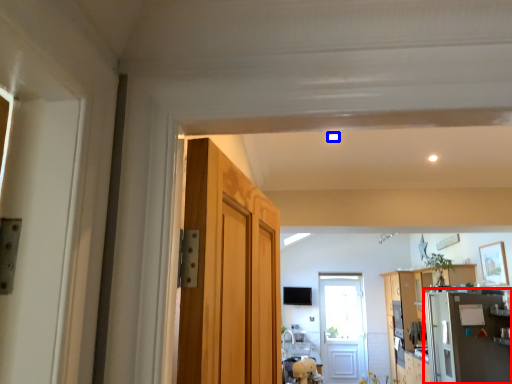
Question: Which of the following is the closest to the observer, appliance (highlighted by a red box) or light (highlighted by a blue box)?

Choices:
 (A) appliance
 (B) light

Answer: (B)